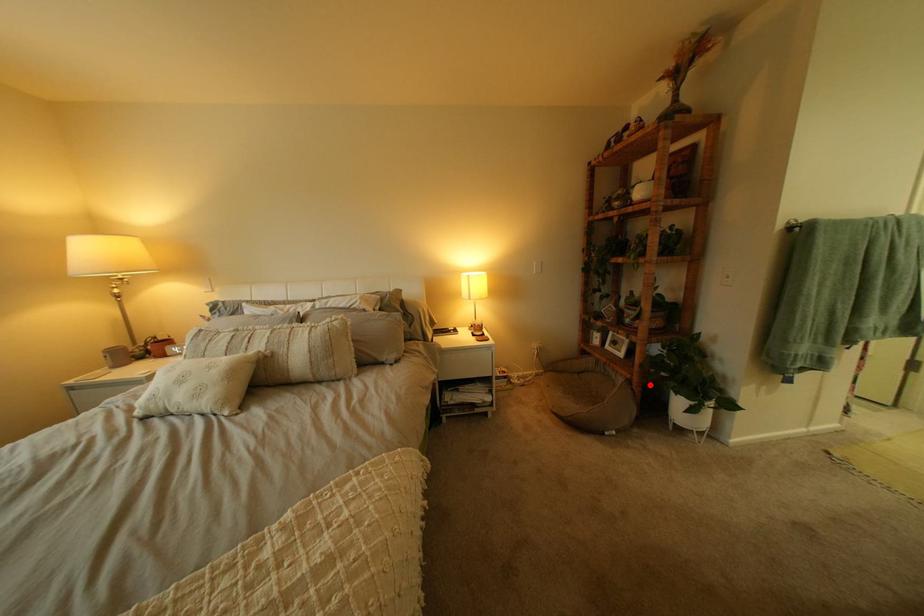
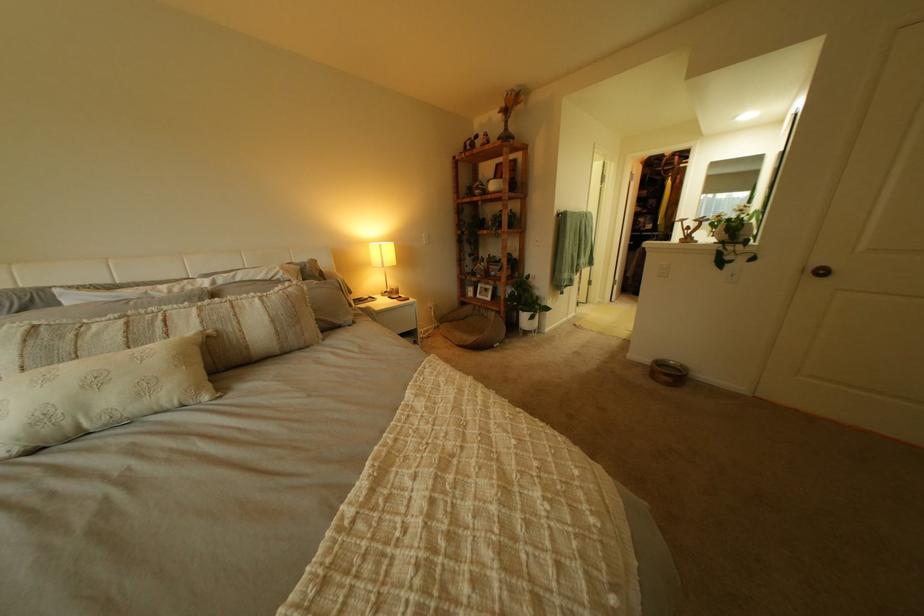
Question: I am providing you with two images of the same scene from different viewpoints. In image1, a red point is highlighted. Considering the same 3D point in image2, which of the following is correct?

Choices:
 (A) It is closer
 (B) It is farther

Answer: (B)